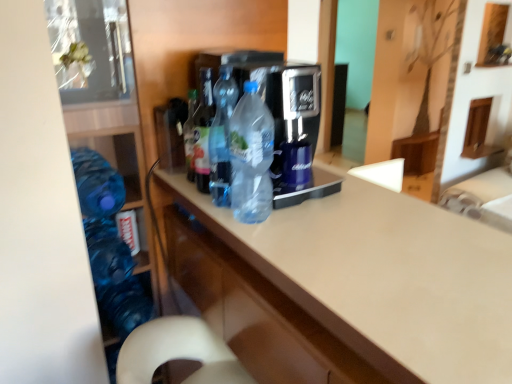
Find the location of a particular element. This screenshot has height=384, width=512. vacant area to the right of translucent plastic bottle at center, the 2th bottle viewed from the right is located at coordinates tap(308, 211).